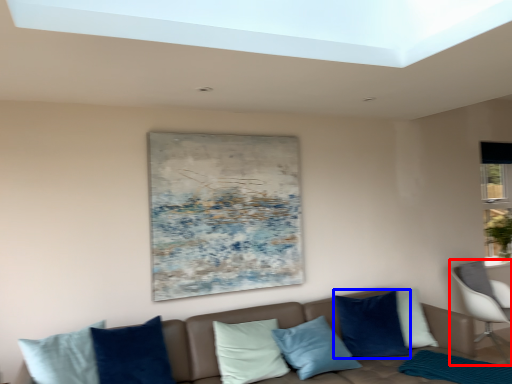
Question: Which object appears farthest to the camera in this image, chair (highlighted by a red box) or pillow (highlighted by a blue box)?

Choices:
 (A) chair
 (B) pillow

Answer: (A)